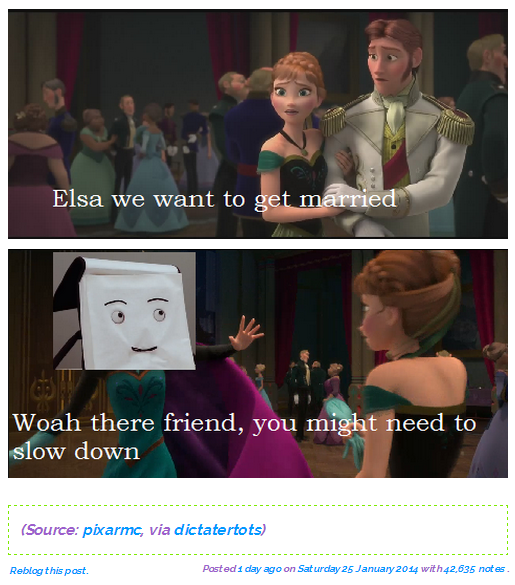
I want to click on wooden floor, so click(x=320, y=459).